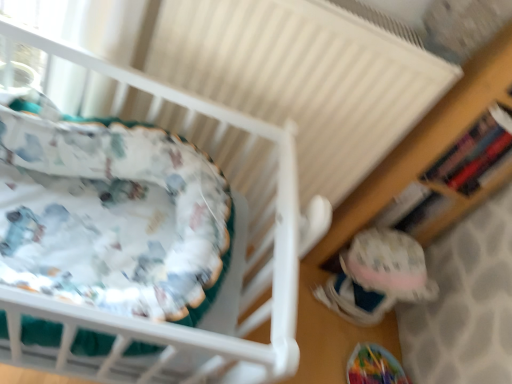
Question: Considering the relative sizes of white textured radiator at upper center and white fabric infant bed at left in the image provided, is white textured radiator at upper center wider than white fabric infant bed at left?

Choices:
 (A) no
 (B) yes

Answer: (A)

Question: Is white textured radiator at upper center facing towards white fabric infant bed at left?

Choices:
 (A) yes
 (B) no

Answer: (A)

Question: Considering the relative sizes of white textured radiator at upper center and white fabric infant bed at left in the image provided, is white textured radiator at upper center thinner than white fabric infant bed at left?

Choices:
 (A) yes
 (B) no

Answer: (A)

Question: Are white textured radiator at upper center and white fabric infant bed at left beside each other?

Choices:
 (A) yes
 (B) no

Answer: (B)

Question: Is white textured radiator at upper center shorter than white fabric infant bed at left?

Choices:
 (A) yes
 (B) no

Answer: (B)

Question: Considering the relative sizes of white textured radiator at upper center and white fabric infant bed at left in the image provided, is white textured radiator at upper center bigger than white fabric infant bed at left?

Choices:
 (A) yes
 (B) no

Answer: (A)

Question: Is wooden bookshelf at right looking in the opposite direction of fuzzy fabric toy at lower right?

Choices:
 (A) no
 (B) yes

Answer: (A)

Question: Is wooden bookshelf at right taller than fuzzy fabric toy at lower right?

Choices:
 (A) yes
 (B) no

Answer: (A)

Question: Is there a large distance between wooden bookshelf at right and fuzzy fabric toy at lower right?

Choices:
 (A) no
 (B) yes

Answer: (A)

Question: Considering the relative sizes of wooden bookshelf at right and fuzzy fabric toy at lower right in the image provided, is wooden bookshelf at right bigger than fuzzy fabric toy at lower right?

Choices:
 (A) yes
 (B) no

Answer: (B)

Question: Is wooden bookshelf at right to the right of fuzzy fabric toy at lower right from the viewer's perspective?

Choices:
 (A) no
 (B) yes

Answer: (B)

Question: From a real-world perspective, is wooden bookshelf at right on top of fuzzy fabric toy at lower right?

Choices:
 (A) no
 (B) yes

Answer: (B)

Question: Is white fabric infant bed at left closer to the viewer compared to fuzzy fabric toy at lower right?

Choices:
 (A) yes
 (B) no

Answer: (A)